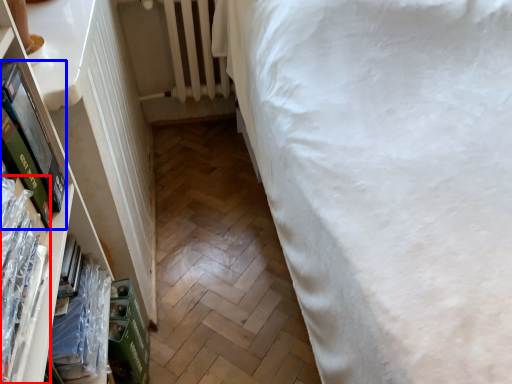
Question: Which of the following is the farthest to the observer, book (highlighted by a red box) or paperback book (highlighted by a blue box)?

Choices:
 (A) book
 (B) paperback book

Answer: (B)